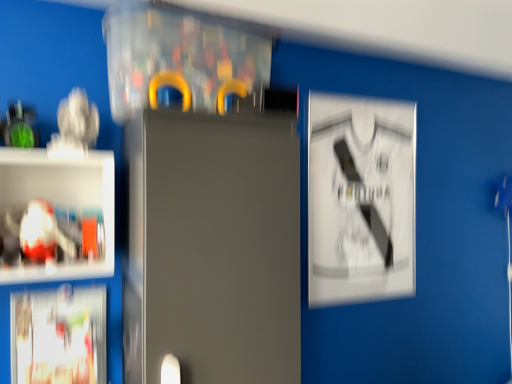
Question: From a real-world perspective, is white glossy poster at lower left, which is counted as the first poster, starting from the left, below translucent plastic shelf at left?

Choices:
 (A) no
 (B) yes

Answer: (B)

Question: Does white glossy poster at lower left, acting as the 2th poster starting from the top, have a greater width compared to translucent plastic shelf at left?

Choices:
 (A) yes
 (B) no

Answer: (B)

Question: Would you say white glossy poster at lower left, acting as the 2th poster starting from the back, is outside translucent plastic shelf at left?

Choices:
 (A) no
 (B) yes

Answer: (B)

Question: Considering the relative positions of white glossy poster at lower left, acting as the 2th poster starting from the back, and translucent plastic shelf at left in the image provided, is white glossy poster at lower left, acting as the 2th poster starting from the back, behind translucent plastic shelf at left?

Choices:
 (A) yes
 (B) no

Answer: (A)

Question: Is white glossy poster at lower left, the first poster positioned from the bottom, to the left of translucent plastic shelf at left from the viewer's perspective?

Choices:
 (A) yes
 (B) no

Answer: (A)

Question: Is white glossy poster at lower left, which is counted as the first poster, starting from the left, facing away from translucent plastic shelf at left?

Choices:
 (A) yes
 (B) no

Answer: (B)

Question: Does satin gray fridge at center lie in front of translucent plastic shelf at left?

Choices:
 (A) yes
 (B) no

Answer: (A)

Question: Can you confirm if satin gray fridge at center is smaller than translucent plastic shelf at left?

Choices:
 (A) no
 (B) yes

Answer: (A)

Question: Is satin gray fridge at center thinner than translucent plastic shelf at left?

Choices:
 (A) yes
 (B) no

Answer: (B)

Question: Does satin gray fridge at center appear on the right side of translucent plastic shelf at left?

Choices:
 (A) yes
 (B) no

Answer: (A)

Question: Does satin gray fridge at center have a lesser height compared to translucent plastic shelf at left?

Choices:
 (A) yes
 (B) no

Answer: (B)

Question: Is satin gray fridge at center bigger than translucent plastic shelf at left?

Choices:
 (A) yes
 (B) no

Answer: (A)

Question: From the image's perspective, would you say transparent plastic cabinet at upper center is positioned over white paper at upper right, the 2th poster when ordered from front to back?

Choices:
 (A) yes
 (B) no

Answer: (A)